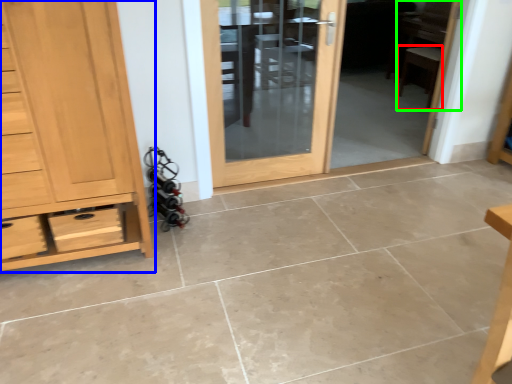
Question: Which object is the closest to the chair (highlighted by a red box)? Choose among these: chest of drawers (highlighted by a blue box) or chair (highlighted by a green box).

Choices:
 (A) chest of drawers
 (B) chair

Answer: (B)